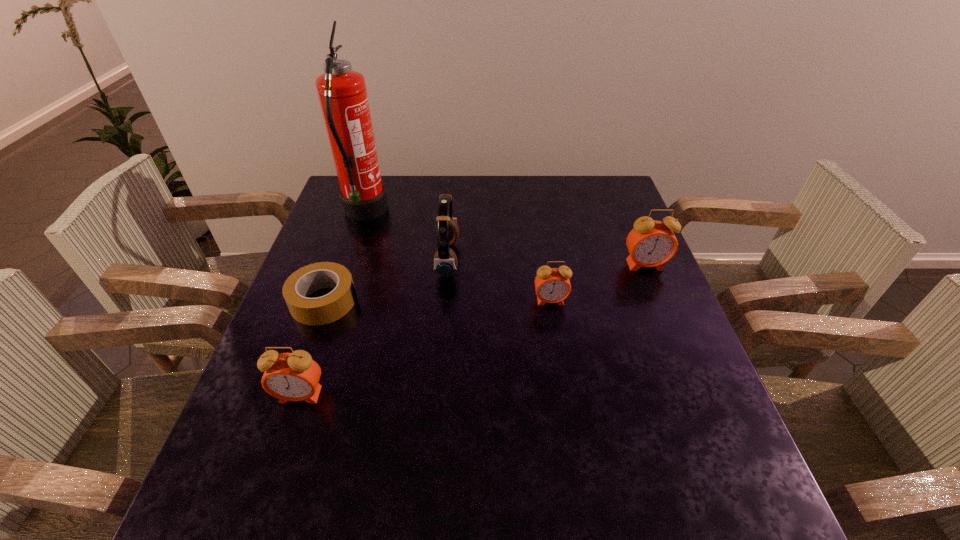
Identify the location of the nearest object. (294, 376).

The width and height of the screenshot is (960, 540). I want to click on the nearest alarm clock, so click(x=294, y=376).

Where is `the shortest alarm clock`? the shortest alarm clock is located at coordinates click(x=552, y=285).

Locate an element on the screen. The width and height of the screenshot is (960, 540). the fifth object from left to right is located at coordinates (552, 285).

Where is `the farthest alarm clock`? This screenshot has height=540, width=960. the farthest alarm clock is located at coordinates [651, 243].

Locate an element on the screen. This screenshot has height=540, width=960. the rightmost object is located at coordinates (651, 243).

Locate an element on the screen. This screenshot has width=960, height=540. the farthest object is located at coordinates (342, 93).

This screenshot has height=540, width=960. In order to click on fire extinguisher in this screenshot , I will do `click(342, 93)`.

Where is `the shortest object`? This screenshot has height=540, width=960. the shortest object is located at coordinates (326, 309).

The width and height of the screenshot is (960, 540). I want to click on headset, so click(x=445, y=262).